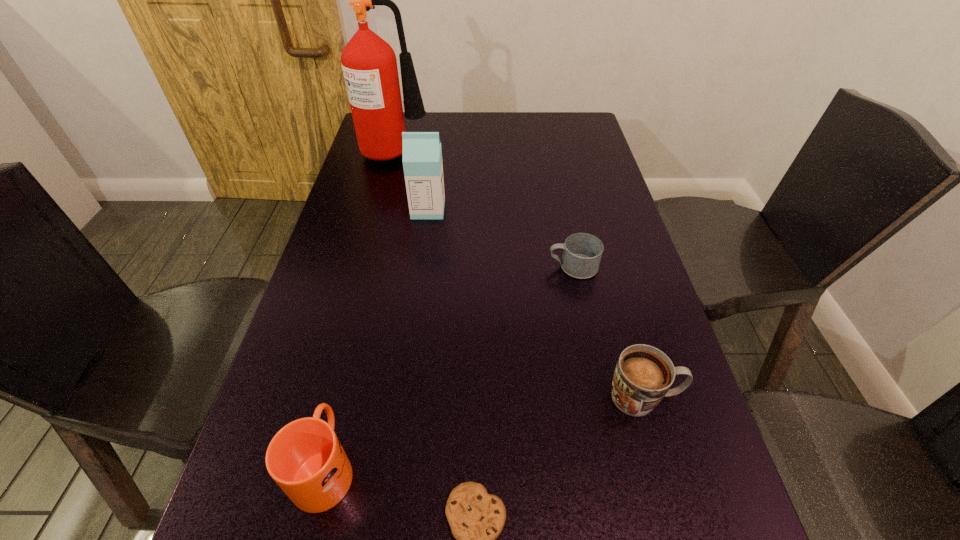
Image resolution: width=960 pixels, height=540 pixels. What are the coordinates of `vacant space located 0.190m at the nozzle of the fire extinguisher` in the screenshot? It's located at (489, 150).

The width and height of the screenshot is (960, 540). Identify the location of vacant space located 0.120m on the left of the fifth nearest object. (369, 210).

Where is `free space located 0.320m on the handle side of the third tallest object`? The image size is (960, 540). free space located 0.320m on the handle side of the third tallest object is located at coordinates (367, 293).

At what (x,y) coordinates should I click in order to perform the action: click on vacant area situated on the handle side of the third tallest object. Please return your answer as a coordinate pair (x, y). The image size is (960, 540). Looking at the image, I should click on point(353,351).

In order to click on blank space located 0.360m on the handle side of the third tallest object in this screenshot , I will do `click(370, 280)`.

You are a GUI agent. You are given a task and a screenshot of the screen. Output one action in this format:
    pyautogui.click(x=<x>, y=<y>)
    Task: Click on the free location located on the side of the third farthest object with the handle
    This screenshot has height=540, width=960.
    Given the screenshot: What is the action you would take?
    pyautogui.click(x=469, y=267)

Where is `blank space located 0.130m on the side of the third farthest object with the handle`? blank space located 0.130m on the side of the third farthest object with the handle is located at coordinates (494, 267).

Identify the location of free space located on the side of the third farthest object with the handle. The height and width of the screenshot is (540, 960). (527, 267).

You are a GUI agent. You are given a task and a screenshot of the screen. Output one action in this format:
    pyautogui.click(x=<x>, y=<y>)
    Task: Click on the object situated at the far edge
    Image resolution: width=960 pixels, height=540 pixels.
    Given the screenshot: What is the action you would take?
    pyautogui.click(x=369, y=64)

What are the coordinates of `fire extinguisher positioned at the left edge` in the screenshot? It's located at (369, 64).